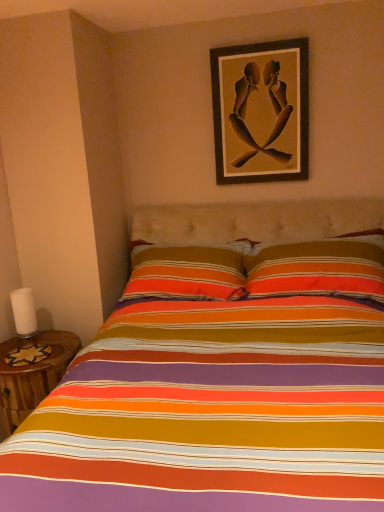
Image resolution: width=384 pixels, height=512 pixels. I want to click on empty space that is ontop of wooden table at lower left (from a real-world perspective), so click(x=24, y=346).